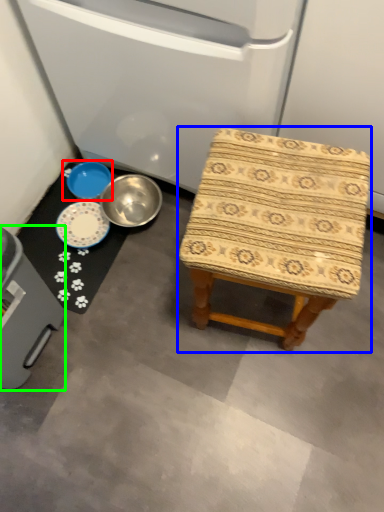
Question: Based on their relative distances, which object is nearer to basin (highlighted by a red box)? Choose from stool (highlighted by a blue box) and appliance (highlighted by a green box).

Choices:
 (A) stool
 (B) appliance

Answer: (B)